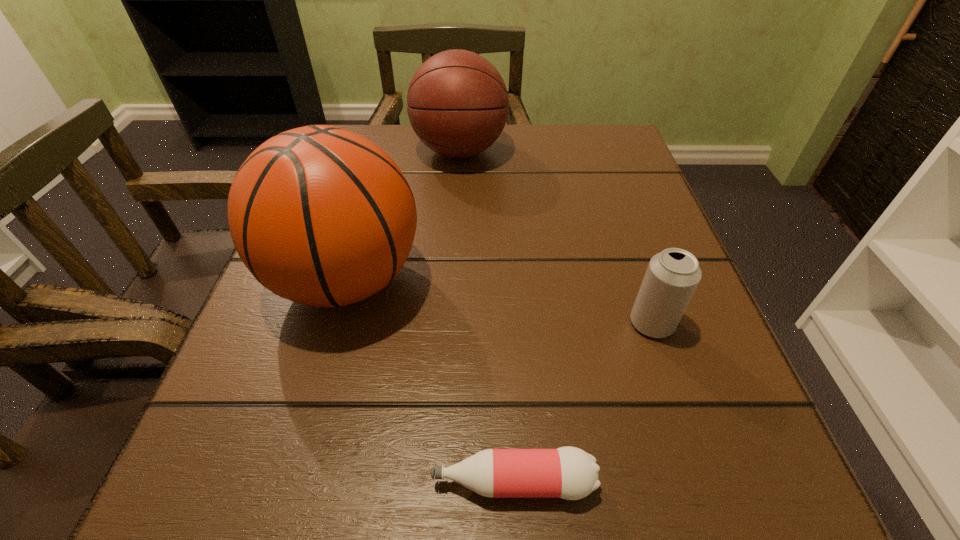
Identify the location of vacant space at the right edge of the desktop. This screenshot has width=960, height=540. (619, 349).

Where is `vacant space at the near left corner of the desktop`? This screenshot has width=960, height=540. vacant space at the near left corner of the desktop is located at coordinates (224, 508).

In the image, there is a desktop. Where is `blank space at the far right corner`? This screenshot has width=960, height=540. blank space at the far right corner is located at coordinates [x=595, y=132].

In the image, there is a desktop. Identify the location of free space at the near right corner. (698, 481).

Find the location of a particular element. free spot between the nearer basketball and the rightmost object is located at coordinates (499, 302).

At what (x,y) coordinates should I click in order to perform the action: click on vacant area that lies between the taller basketball and the beer can. Please return your answer as a coordinate pair (x, y). The width and height of the screenshot is (960, 540). Looking at the image, I should click on (499, 302).

Where is `free spot between the beer can and the shorter basketball`? This screenshot has width=960, height=540. free spot between the beer can and the shorter basketball is located at coordinates (556, 237).

The width and height of the screenshot is (960, 540). Find the location of `vacant space that's between the shortest object and the farthest object`. vacant space that's between the shortest object and the farthest object is located at coordinates (487, 316).

You are a GUI agent. You are given a task and a screenshot of the screen. Output one action in this format:
    pyautogui.click(x=<x>, y=<y>)
    Task: Click on the free spot between the shortest object and the tallest object
    
    Given the screenshot: What is the action you would take?
    pyautogui.click(x=430, y=381)

Identify the location of free space between the taller basketball and the rightmost object. The image size is (960, 540). (499, 302).